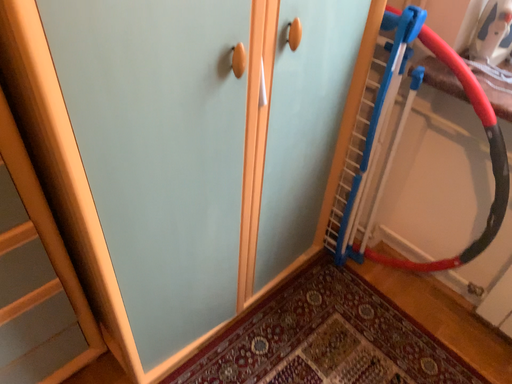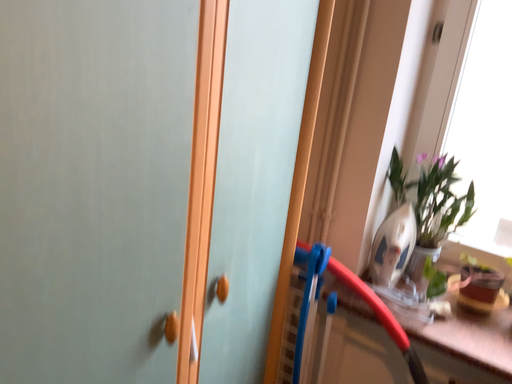
Question: Which way did the camera rotate in the video?

Choices:
 (A) rotated upward
 (B) rotated downward

Answer: (A)